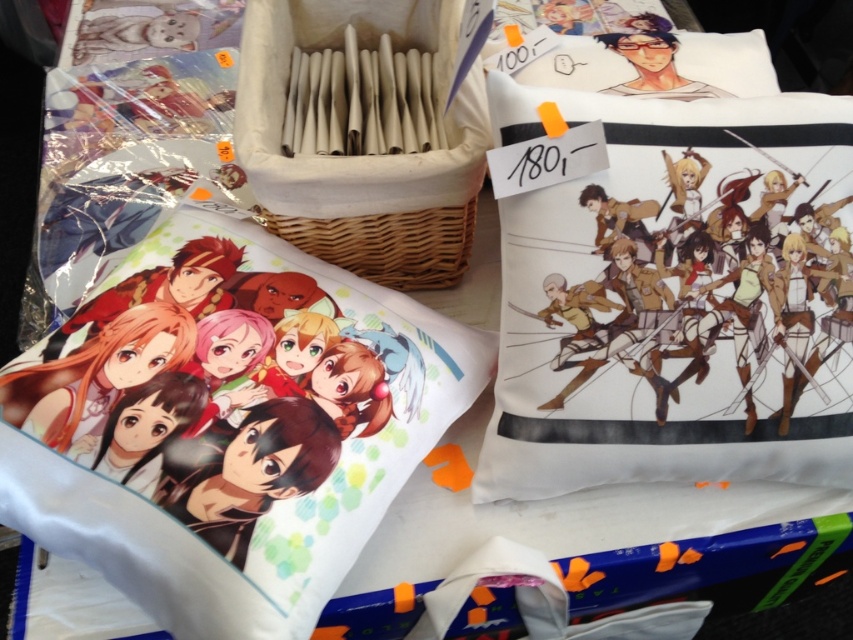
Which is above, white cotton pillow at right or woven wood basket at center?

woven wood basket at center is higher up.

Does white cotton pillow at right lie behind woven wood basket at center?

No.

Identify the location of white cotton pillow at right. Image resolution: width=853 pixels, height=640 pixels. [x=671, y=292].

The width and height of the screenshot is (853, 640). What are the coordinates of `white cotton pillow at right` in the screenshot? It's located at (671, 292).

Is white cotton pillow at right bigger than matte white pillow with anime characters at center?

No.

Is point (781, 145) in front of point (56, 499)?

No, (781, 145) is further to viewer.

Is point (552, 112) farther from viewer compared to point (183, 451)?

Yes, it is behind point (183, 451).

Image resolution: width=853 pixels, height=640 pixels. Find the location of `white cotton pillow at right`. white cotton pillow at right is located at coordinates (671, 292).

Does matte white pillow with anime characters at center have a lesser width compared to woven wood basket at center?

No.

Which is more to the left, matte white pillow with anime characters at center or woven wood basket at center?

matte white pillow with anime characters at center is more to the left.

Who is more distant from viewer, (268, 486) or (393, 230)?

The point (393, 230) is more distant.

Locate an element on the screen. The height and width of the screenshot is (640, 853). matte white pillow with anime characters at center is located at coordinates (234, 428).